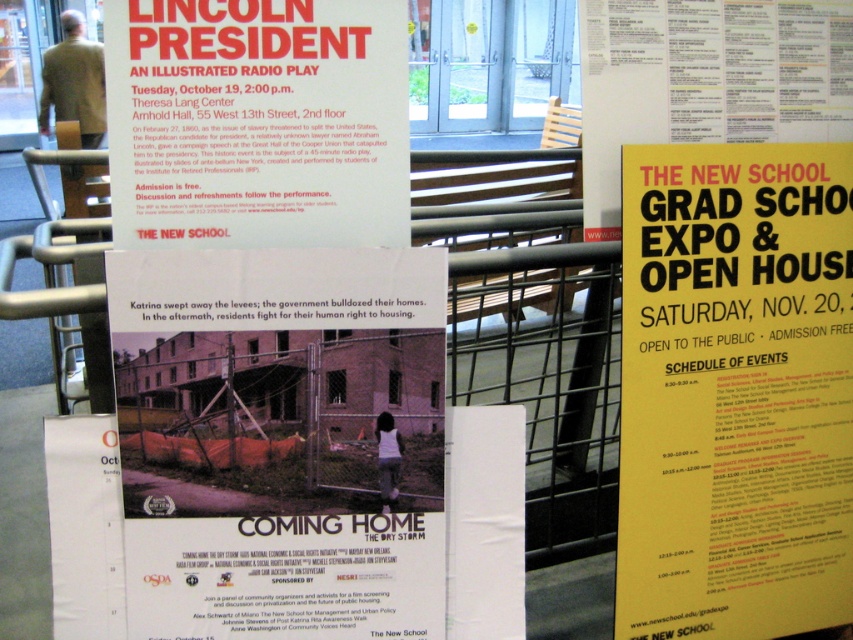
Question: Can you confirm if yellow paper at upper right is positioned above matte red poster at upper left?

Choices:
 (A) no
 (B) yes

Answer: (A)

Question: Which object appears closest to the camera in this image?

Choices:
 (A) yellow paper at upper right
 (B) matte red poster at upper left

Answer: (B)

Question: Can you confirm if yellow paper at upper right is positioned to the left of matte red poster at upper left?

Choices:
 (A) yes
 (B) no

Answer: (B)

Question: Can you confirm if yellow paper at upper right is positioned below matte red poster at upper left?

Choices:
 (A) yes
 (B) no

Answer: (A)

Question: Which point is closer to the camera?

Choices:
 (A) yellow paper at upper right
 (B) matte red poster at upper left

Answer: (B)

Question: Which point is closer to the camera taking this photo?

Choices:
 (A) (109, 113)
 (B) (828, 592)

Answer: (A)